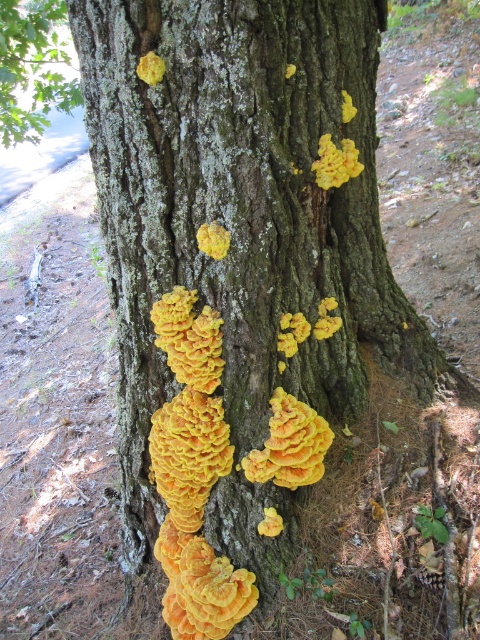
You are standing 10 feet away from the tree with the yellow textured fungi at center. You want to take a photo of the fungi without moving closer. Is the fungi within the standard camera focus range of 5 feet minimum focus distance?

The yellow textured fungi at center is 4.84 feet away from the camera, which is slightly less than the standard camera focus range of 5 feet. Therefore, the camera might not be able to focus on the fungi clearly without moving closer.

You are a mycologist standing 1.8 meters tall and want to examine the yellow crusty fungus at center. If you extend your arm fully, which typically reaches 0.6 meters from your shoulder, can you reach the fungus without moving closer?

The yellow crusty fungus at center is 1.48 meters away from the camera. Since the mycologist is 1.8 meters tall and can extend their arm 0.6 meters, their total reach is 1.8m height plus 0.6m arm extension equals 2.4 meters. Since 2.4 meters is greater than 1.48 meters, they can reach the fungus without moving closer.